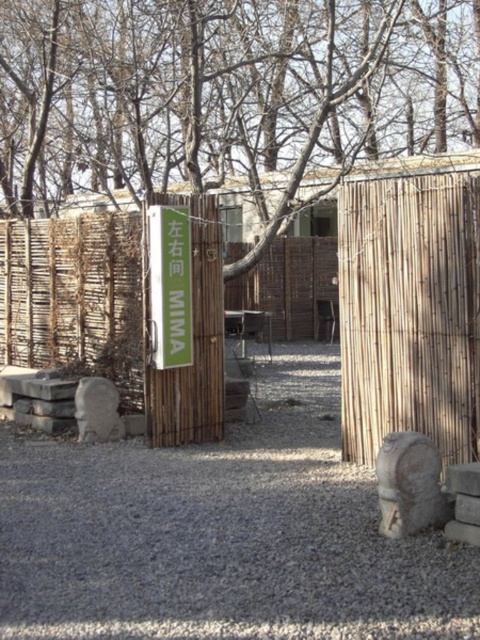
You are a gardener who wants to plant a row of flowers along the path. The flowers require a minimum of 30 cm of space between them and any obstacles. You see the gray gravel at center and the bamboo fence at center. Which area can you safely plant the flowers without violating the spacing requirement?

The gray gravel at center might be wider than bamboo fence at center, so you should plant the flowers in the gray gravel at center to ensure sufficient space between them and the bamboo fence at center.

You are standing at the entrance of the garden and want to locate the green matte sign at center. According to the coordinates provided, which direction should you walk to reach it?

The green matte sign at center is located at coordinates point [169,285], so you should walk towards the center of the image to reach it.

Consider the image. You are planning to place a small decorative item on the gravel path. The gray stone at lower right is currently there. If you want to replace it with the green matte sign at center, will the sign fit in the same space?

The green matte sign at center is larger in size than the gray stone at lower right, so it will not fit in the same space.